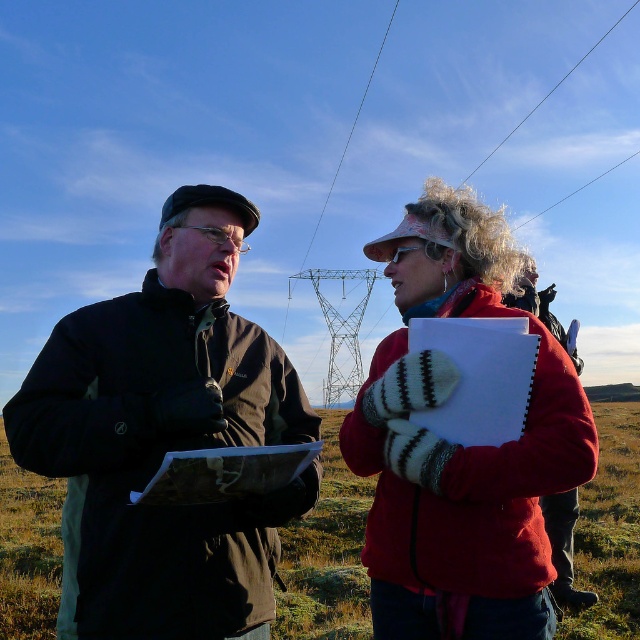
Question: Can you confirm if dark brown jacket at center is positioned to the right of red woolen mittens at center?

Choices:
 (A) no
 (B) yes

Answer: (A)

Question: Is the position of dark brown jacket at center more distant than that of red woolen mittens at center?

Choices:
 (A) yes
 (B) no

Answer: (B)

Question: Which point is farther to the camera?

Choices:
 (A) dark brown jacket at center
 (B) red woolen mittens at center

Answer: (B)

Question: Which of the following is the closest to the observer?

Choices:
 (A) red woolen mittens at center
 (B) dark brown jacket at center

Answer: (B)

Question: Which of the following is the closest to the observer?

Choices:
 (A) (186, 449)
 (B) (499, 307)

Answer: (A)

Question: Is dark brown jacket at center above red woolen mittens at center?

Choices:
 (A) no
 (B) yes

Answer: (A)